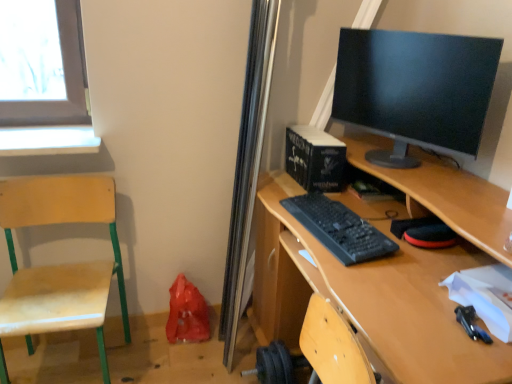
Question: Considering the relative sizes of wooden swivel chair at left and black plastic keyboard at center in the image provided, is wooden swivel chair at left bigger than black plastic keyboard at center?

Choices:
 (A) no
 (B) yes

Answer: (B)

Question: Is wooden swivel chair at left closer to the viewer compared to black plastic keyboard at center?

Choices:
 (A) yes
 (B) no

Answer: (B)

Question: Is black plastic keyboard at center completely or partially inside wooden swivel chair at left?

Choices:
 (A) yes
 (B) no

Answer: (B)

Question: From a real-world perspective, is wooden swivel chair at left below black plastic keyboard at center?

Choices:
 (A) no
 (B) yes

Answer: (B)

Question: Is wooden swivel chair at left to the right of black plastic keyboard at center from the viewer's perspective?

Choices:
 (A) yes
 (B) no

Answer: (B)

Question: In terms of height, does wooden desk at center look taller or shorter compared to black plastic keyboard at center?

Choices:
 (A) tall
 (B) short

Answer: (A)

Question: Is point (487, 263) positioned closer to the camera than point (324, 235)?

Choices:
 (A) farther
 (B) closer

Answer: (B)

Question: In terms of width, does wooden desk at center look wider or thinner when compared to black plastic keyboard at center?

Choices:
 (A) thin
 (B) wide

Answer: (B)

Question: Which is correct: wooden desk at center is inside black plastic keyboard at center, or outside of it?

Choices:
 (A) inside
 (B) outside

Answer: (B)

Question: From their relative heights in the image, would you say black glossy monitor at upper right is taller or shorter than wooden swivel chair at left?

Choices:
 (A) tall
 (B) short

Answer: (B)

Question: Relative to wooden swivel chair at left, is black glossy monitor at upper right in front or behind?

Choices:
 (A) behind
 (B) front

Answer: (B)

Question: From a real-world perspective, is black glossy monitor at upper right positioned above or below wooden swivel chair at left?

Choices:
 (A) above
 (B) below

Answer: (A)

Question: From the image's perspective, is black glossy monitor at upper right above or below wooden swivel chair at left?

Choices:
 (A) above
 (B) below

Answer: (A)

Question: In the image, is black glossy monitor at upper right positioned in front of or behind black plastic keyboard at center?

Choices:
 (A) front
 (B) behind

Answer: (A)

Question: From their relative heights in the image, would you say black glossy monitor at upper right is taller or shorter than black plastic keyboard at center?

Choices:
 (A) short
 (B) tall

Answer: (B)